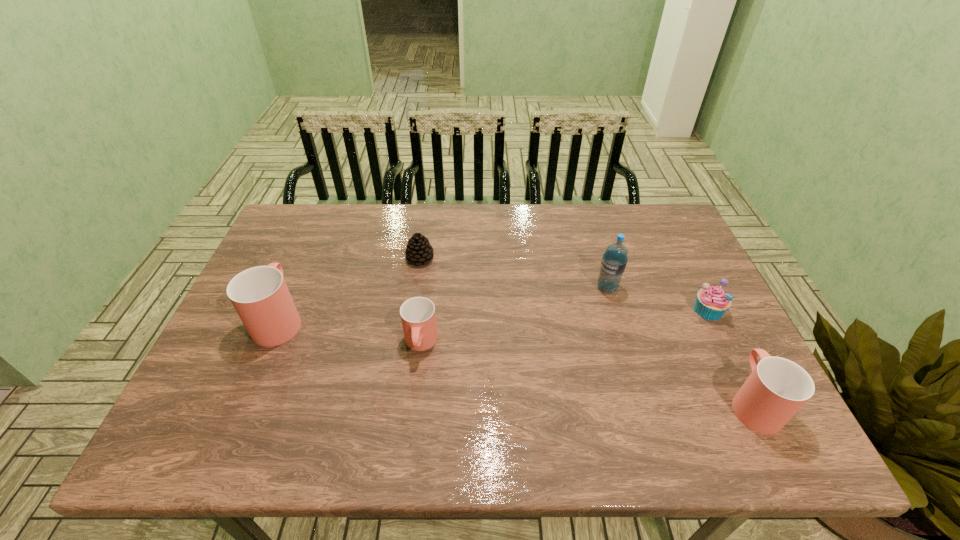
Find the location of a particular element. free point located on the side of the tallest cup with the handle is located at coordinates (309, 249).

Locate an element on the screen. The height and width of the screenshot is (540, 960). free point located on the side of the nearest object with the handle is located at coordinates (684, 262).

Locate an element on the screen. vacant position located on the side of the nearest object with the handle is located at coordinates (683, 260).

Where is `vacant space located on the side of the nearest object with the handle`? The image size is (960, 540). vacant space located on the side of the nearest object with the handle is located at coordinates (718, 333).

At what (x,y) coordinates should I click in order to perform the action: click on free space located on the left of the water bottle. Please return your answer as a coordinate pair (x, y). Looking at the image, I should click on (520, 288).

This screenshot has width=960, height=540. What are the coordinates of `vacant space positioned on the left of the muffin` in the screenshot? It's located at (576, 310).

You are a GUI agent. You are given a task and a screenshot of the screen. Output one action in this format:
    pyautogui.click(x=<x>, y=<y>)
    Task: Click on the blank area located 0.250m at the narrow end of the pinecone
    The height and width of the screenshot is (540, 960).
    Given the screenshot: What is the action you would take?
    point(409,335)

The width and height of the screenshot is (960, 540). Identify the location of object at the far edge. (x=418, y=251).

Find the location of a particular element. The image size is (960, 540). object at the near edge is located at coordinates (777, 388).

Find the location of a particular element. The height and width of the screenshot is (540, 960). object that is at the left edge is located at coordinates (260, 296).